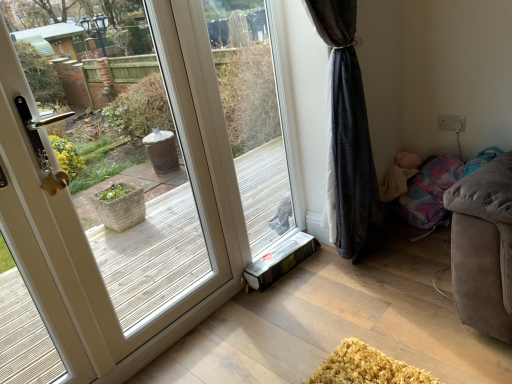
Question: Considering the relative sizes of white glossy door at left and soft beige blanket at lower right in the image provided, is white glossy door at left smaller than soft beige blanket at lower right?

Choices:
 (A) no
 (B) yes

Answer: (A)

Question: Can we say white glossy door at left lies outside soft beige blanket at lower right?

Choices:
 (A) no
 (B) yes

Answer: (B)

Question: Is white glossy door at left closer to camera compared to soft beige blanket at lower right?

Choices:
 (A) no
 (B) yes

Answer: (B)

Question: Is white glossy door at left facing towards soft beige blanket at lower right?

Choices:
 (A) yes
 (B) no

Answer: (B)

Question: From the image's perspective, is white glossy door at left on top of soft beige blanket at lower right?

Choices:
 (A) yes
 (B) no

Answer: (B)

Question: From a real-world perspective, does white glossy door at left stand above soft beige blanket at lower right?

Choices:
 (A) yes
 (B) no

Answer: (A)

Question: From a real-world perspective, is transparent glass window at center positioned over white glossy door at left based on gravity?

Choices:
 (A) yes
 (B) no

Answer: (B)

Question: Would you say transparent glass window at center contains white glossy door at left?

Choices:
 (A) no
 (B) yes

Answer: (A)

Question: Is transparent glass window at center completely or partially outside of white glossy door at left?

Choices:
 (A) no
 (B) yes

Answer: (B)

Question: Does transparent glass window at center have a larger size compared to white glossy door at left?

Choices:
 (A) no
 (B) yes

Answer: (A)

Question: Does transparent glass window at center have a greater width compared to white glossy door at left?

Choices:
 (A) yes
 (B) no

Answer: (B)

Question: From the image's perspective, is transparent glass window at center on top of white glossy door at left?

Choices:
 (A) yes
 (B) no

Answer: (A)

Question: From the image's perspective, is soft beige blanket at lower right under white glossy door at left?

Choices:
 (A) yes
 (B) no

Answer: (B)